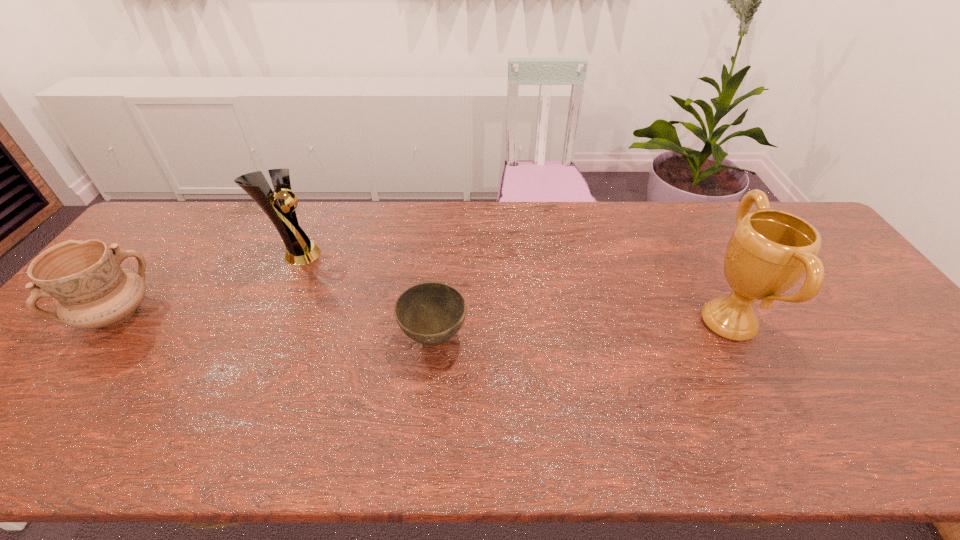
This screenshot has width=960, height=540. I want to click on free space located on the front of the nearer award with the decoration, so click(658, 322).

This screenshot has height=540, width=960. Find the location of `vacant space located 0.290m at the front of the farthest object, where the globe is visible`. vacant space located 0.290m at the front of the farthest object, where the globe is visible is located at coordinates (415, 254).

In order to click on vacant point located 0.180m on the right of the leftmost object in this screenshot , I will do `click(220, 314)`.

In order to click on free space located 0.250m on the right of the second object from right to left in this screenshot , I will do `click(566, 338)`.

Where is `object at the far edge`? object at the far edge is located at coordinates (300, 250).

I want to click on object that is at the left edge, so 92,290.

The height and width of the screenshot is (540, 960). I want to click on vacant space at the far edge, so click(x=568, y=234).

Where is `vacant space at the near edge of the desktop`? The width and height of the screenshot is (960, 540). vacant space at the near edge of the desktop is located at coordinates (653, 457).

The image size is (960, 540). In order to click on vacant space at the left edge of the desktop in this screenshot , I will do `click(178, 248)`.

In the image, there is a desktop. Identify the location of vacant space at the right edge. (841, 294).